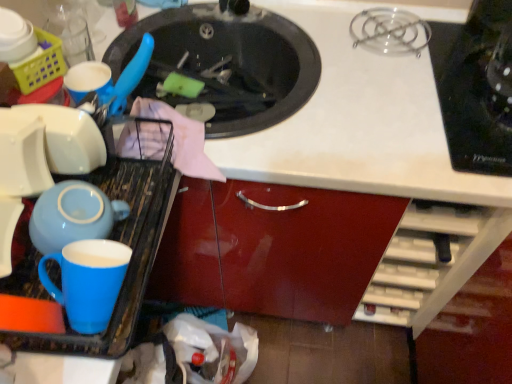
Describe the element at coordinates (88, 281) in the screenshot. I see `matte blue mug at lower left` at that location.

Describe the element at coordinates (227, 63) in the screenshot. I see `black glossy sink at upper center` at that location.

Find the location of a particular element. blue glossy mug at left is located at coordinates (109, 238).

Is black glossy sink at upper center oriented towards matte blue mug at lower left?

No, black glossy sink at upper center is not oriented towards matte blue mug at lower left.

Considering the points (207, 135) and (84, 323), which point is behind, point (207, 135) or point (84, 323)?

The point (207, 135) is farther from the camera.

Can you confirm if black glossy sink at upper center is thinner than matte blue mug at lower left?

No.

From the image's perspective, which object appears higher, black glossy sink at upper center or blue glossy mug at left?

black glossy sink at upper center is shown above in the image.

Measure the distance between black glossy sink at upper center and blue glossy mug at left.

12.46 inches.

Considering the positions of objects black glossy sink at upper center and blue glossy mug at left in the image provided, who is behind, black glossy sink at upper center or blue glossy mug at left?

black glossy sink at upper center is behind.

Can you confirm if black glossy sink at upper center is wider than blue glossy mug at left?

Correct, the width of black glossy sink at upper center exceeds that of blue glossy mug at left.

Is the depth of matte blue mug at lower left less than that of plastic yellow basket at upper left?

Yes, it is.

How different are the orientations of matte blue mug at lower left and plastic yellow basket at upper left in degrees?

32.8 degrees separate the facing orientations of matte blue mug at lower left and plastic yellow basket at upper left.

From a real-world perspective, between matte blue mug at lower left and plastic yellow basket at upper left, who is vertically lower?

matte blue mug at lower left, from a real-world perspective.

How much distance is there between matte blue mug at lower left and plastic yellow basket at upper left?

matte blue mug at lower left is 15.07 inches away from plastic yellow basket at upper left.

Considering the sizes of objects matte blue mug at lower left and blue glossy mug at left in the image provided, who is shorter, matte blue mug at lower left or blue glossy mug at left?

With less height is matte blue mug at lower left.

Considering the sizes of objects matte blue mug at lower left and blue glossy mug at left in the image provided, who is smaller, matte blue mug at lower left or blue glossy mug at left?

matte blue mug at lower left is smaller.

Is matte blue mug at lower left closer to the viewer compared to blue glossy mug at left?

No, matte blue mug at lower left is behind blue glossy mug at left.

From a real-world perspective, relative to blue glossy mug at left, is matte blue mug at lower left vertically above or below?

matte blue mug at lower left is situated higher than blue glossy mug at left in the real world.

Which is correct: black glass cooktop at upper right is inside blue glossy mug at left, or outside of it?

black glass cooktop at upper right is not inside blue glossy mug at left, it's outside.

Is point (444, 126) behind point (150, 212)?

Yes, point (444, 126) is behind point (150, 212).

From the image's perspective, would you say black glass cooktop at upper right is shown under blue glossy mug at left?

No.

Considering the relative sizes of black glass cooktop at upper right and blue glossy mug at left in the image provided, is black glass cooktop at upper right wider than blue glossy mug at left?

Indeed, black glass cooktop at upper right has a greater width compared to blue glossy mug at left.

Does black glossy sink at upper center have a larger size compared to plastic yellow basket at upper left?

Yes.

In the scene shown: Is black glossy sink at upper center touching plastic yellow basket at upper left?

black glossy sink at upper center and plastic yellow basket at upper left are clearly separated.

Is black glossy sink at upper center in front of or behind plastic yellow basket at upper left in the image?

black glossy sink at upper center is positioned farther from the viewer than plastic yellow basket at upper left.

From the image's perspective, which is below, plastic yellow basket at upper left or black glossy sink at upper center?

plastic yellow basket at upper left appears lower in the image.

In the image, is plastic yellow basket at upper left positioned in front of or behind black glossy sink at upper center?

In the image, plastic yellow basket at upper left appears in front of black glossy sink at upper center.

Locate an element on the screen. coffee cup positioned vertically above the black glossy sink at upper center (from a real-world perspective) is located at coordinates (88, 281).

At what (x,y) coordinates should I click in order to perform the action: click on sink to the right of blue glossy mug at left. Please return your answer as a coordinate pair (x, y). The width and height of the screenshot is (512, 384). Looking at the image, I should click on (227, 63).

From the image, which object appears to be farther from matte blue mug at lower left, plastic yellow basket at upper left or blue glossy mug at left?

plastic yellow basket at upper left lies further to matte blue mug at lower left than the other object.

When comparing their distances from matte blue mug at lower left, does blue glossy mug at left or plastic yellow basket at upper left seem closer?

Among the two, blue glossy mug at left is located nearer to matte blue mug at lower left.

When comparing their distances from blue glossy mug at left, does black glass cooktop at upper right or matte blue mug at lower left seem closer?

matte blue mug at lower left is closer to blue glossy mug at left.

When comparing their distances from matte blue mug at lower left, does black glass cooktop at upper right or blue glossy mug at left seem further?

black glass cooktop at upper right.

In the scene shown: Which object lies further to the anchor point plastic yellow basket at upper left, blue glossy mug at left or black glass cooktop at upper right?

black glass cooktop at upper right lies further to plastic yellow basket at upper left than the other object.

Looking at this image, when comparing their distances from plastic yellow basket at upper left, does black glossy sink at upper center or matte blue mug at lower left seem closer?

black glossy sink at upper center is closer to plastic yellow basket at upper left.

When comparing their distances from matte blue mug at lower left, does black glossy sink at upper center or plastic yellow basket at upper left seem further?

Among the two, black glossy sink at upper center is located further to matte blue mug at lower left.

When comparing their distances from plastic yellow basket at upper left, does matte blue mug at lower left or black glass cooktop at upper right seem further?

black glass cooktop at upper right.

Locate an element on the screen. coffee cup between plastic yellow basket at upper left and black glass cooktop at upper right in the horizontal direction is located at coordinates (88, 281).

Find the location of `coffee cup between blue glossy mug at left and black glass cooktop at upper right`. coffee cup between blue glossy mug at left and black glass cooktop at upper right is located at coordinates (88, 281).

I want to click on basket between black glossy sink at upper center and blue glossy mug at left in the up-down direction, so click(x=40, y=63).

Where is `kitchen appliance that lies between black glossy sink at upper center and matte blue mug at lower left from top to bottom`? kitchen appliance that lies between black glossy sink at upper center and matte blue mug at lower left from top to bottom is located at coordinates (109, 238).